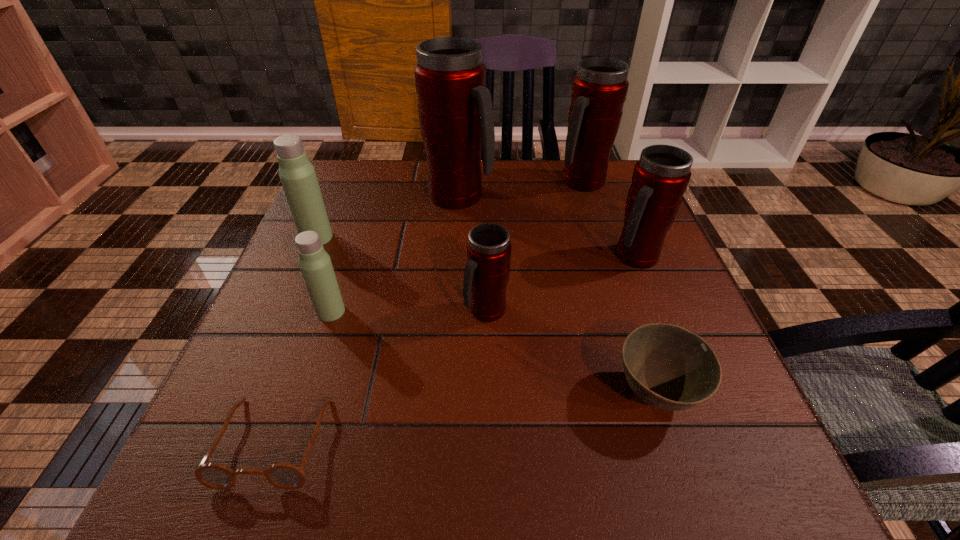
Identify which thermos bottle is located as the third nearest to the smallest red thermos bottle. Please provide its 2D coordinates. Your answer should be formatted as a tuple, i.e. [(x, y)], where the tuple contains the x and y coordinates of a point satisfying the conditions above.

[(455, 111)]

Point out which thermos bottle is positioned as the second nearest to the smallest red thermos bottle. Please provide its 2D coordinates. Your answer should be formatted as a tuple, i.e. [(x, y)], where the tuple contains the x and y coordinates of a point satisfying the conditions above.

[(660, 178)]

Locate an element on the screen. The width and height of the screenshot is (960, 540). red thermos bottle that stands as the closest to the shortest object is located at coordinates (488, 248).

Locate which red thermos bottle ranks third in proximity to the bigger light thermos bottle. Please provide its 2D coordinates. Your answer should be formatted as a tuple, i.e. [(x, y)], where the tuple contains the x and y coordinates of a point satisfying the conditions above.

[(599, 90)]

Locate an element on the screen. This screenshot has width=960, height=540. free space that satisfies the following two spatial constraints: 1. on the side with the handle of the tallest object; 2. on the front-facing side of the shortest object is located at coordinates (444, 441).